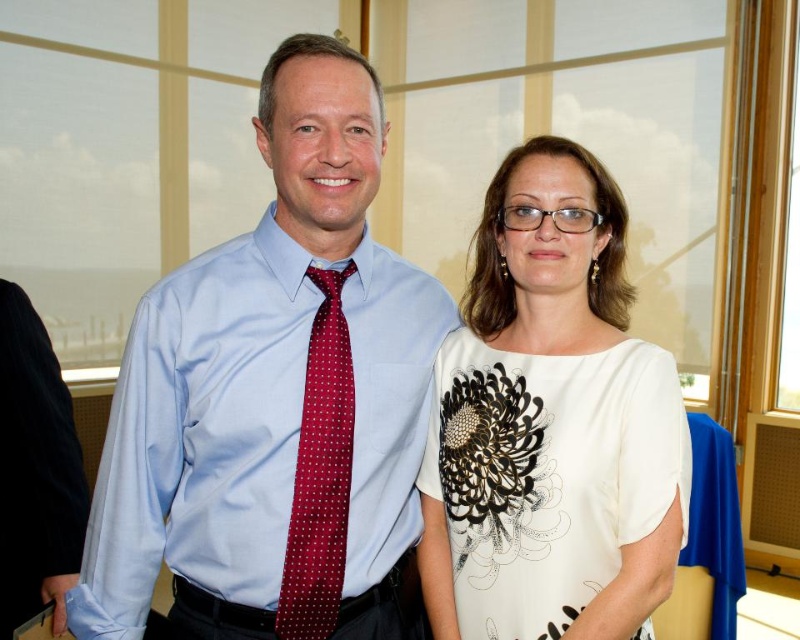
Question: Which of the following is the farthest from the observer?

Choices:
 (A) coord(636,500)
 (B) coord(336,435)
 (C) coord(222,593)

Answer: (B)

Question: Can you confirm if light blue shirt at center is smaller than white printed blouse at center?

Choices:
 (A) no
 (B) yes

Answer: (A)

Question: Can you confirm if light blue shirt at center is positioned above maroon silk tie at center?

Choices:
 (A) no
 (B) yes

Answer: (B)

Question: Is the position of light blue shirt at center less distant than that of white printed blouse at center?

Choices:
 (A) no
 (B) yes

Answer: (A)

Question: Which object is farther from the camera taking this photo?

Choices:
 (A) maroon silk tie at center
 (B) light blue shirt at center
 (C) white printed blouse at center

Answer: (A)

Question: Among these points, which one is nearest to the camera?

Choices:
 (A) (312, 563)
 (B) (390, 540)

Answer: (A)